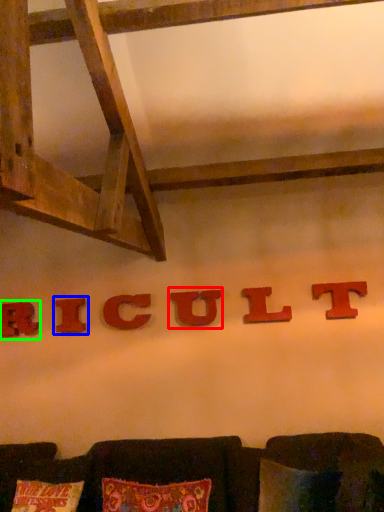
Question: Which is farther away from alphabet (highlighted by a red box)? alphabet (highlighted by a blue box) or alphabet (highlighted by a green box)?

Choices:
 (A) alphabet
 (B) alphabet

Answer: (B)